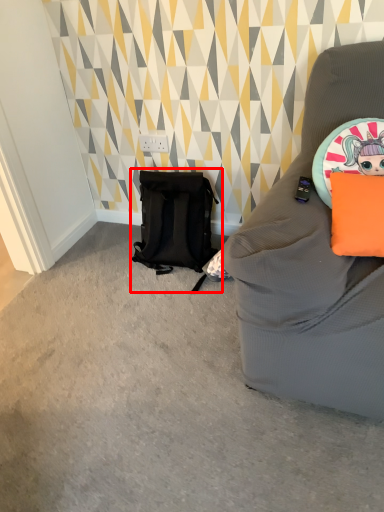
Question: From the image's perspective, what is the correct spatial positioning of backpack (annotated by the red box) in reference to pillow?

Choices:
 (A) above
 (B) below

Answer: (A)